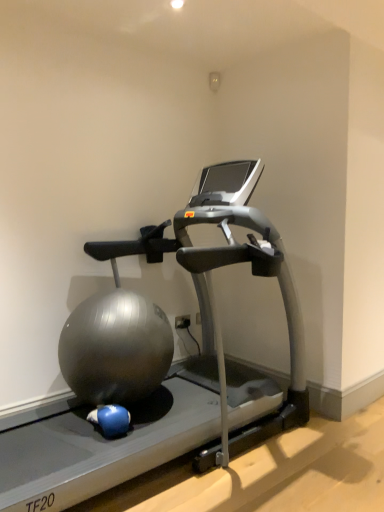
This screenshot has height=512, width=384. What are the coordinates of `silver metallic treadmill at center` in the screenshot? It's located at (158, 364).

Consider the image. Measure the distance between silver metallic treadmill at center and camera.

silver metallic treadmill at center is 1.50 meters from camera.

This screenshot has height=512, width=384. What do you see at coordinates (158, 364) in the screenshot?
I see `silver metallic treadmill at center` at bounding box center [158, 364].

This screenshot has height=512, width=384. Find the location of `silver metallic treadmill at center`. silver metallic treadmill at center is located at coordinates (158, 364).